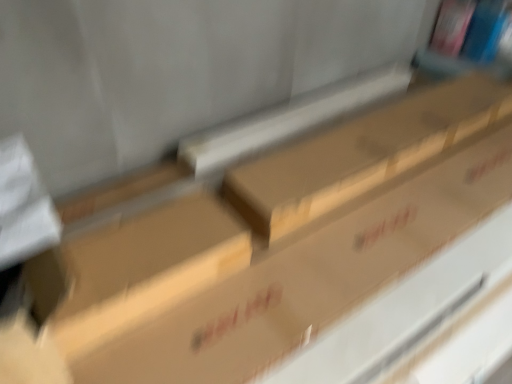
Question: Considering the relative sizes of brown cardboard box at center and brown cardboard box at center in the image provided, is brown cardboard box at center bigger than brown cardboard box at center?

Choices:
 (A) no
 (B) yes

Answer: (B)

Question: From a real-world perspective, is brown cardboard box at center on brown cardboard box at center?

Choices:
 (A) yes
 (B) no

Answer: (A)

Question: Could you tell me if brown cardboard box at center is turned towards brown cardboard box at center?

Choices:
 (A) yes
 (B) no

Answer: (B)

Question: Can you confirm if brown cardboard box at center is positioned to the right of brown cardboard box at center?

Choices:
 (A) yes
 (B) no

Answer: (A)

Question: Does brown cardboard box at center lie behind brown cardboard box at center?

Choices:
 (A) yes
 (B) no

Answer: (A)

Question: Is brown cardboard box at center looking in the opposite direction of brown cardboard box at center?

Choices:
 (A) no
 (B) yes

Answer: (A)

Question: Is brown cardboard box at center not inside brown cardboard box at center?

Choices:
 (A) no
 (B) yes

Answer: (B)

Question: From the image's perspective, is brown cardboard box at center below brown cardboard box at center?

Choices:
 (A) no
 (B) yes

Answer: (B)

Question: Can you see brown cardboard box at center touching brown cardboard box at center?

Choices:
 (A) yes
 (B) no

Answer: (B)

Question: Does brown cardboard box at center have a larger size compared to brown cardboard box at center?

Choices:
 (A) no
 (B) yes

Answer: (A)

Question: Is brown cardboard box at center completely or partially inside brown cardboard box at center?

Choices:
 (A) yes
 (B) no

Answer: (B)

Question: From a real-world perspective, is brown cardboard box at center on top of brown cardboard box at center?

Choices:
 (A) no
 (B) yes

Answer: (A)

Question: From a real-world perspective, relative to brown cardboard box at center, is brown cardboard box at center vertically above or below?

Choices:
 (A) below
 (B) above

Answer: (A)